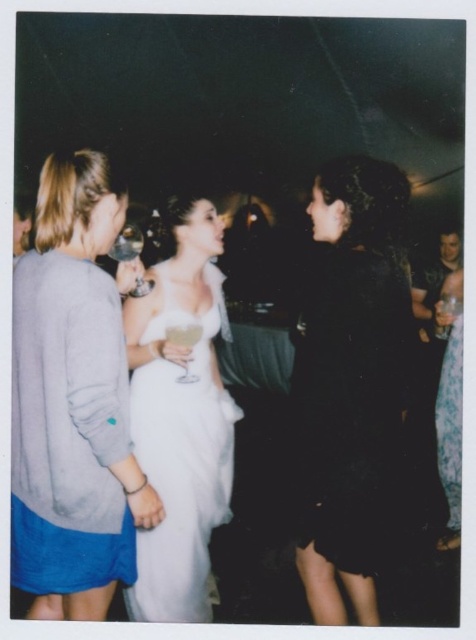
Which is behind, point (106, 163) or point (115, 257)?

Point (115, 257)

From the picture: Does light gray sweater at left have a lesser width compared to translucent glass wine glass at center?

Correct, light gray sweater at left's width is less than translucent glass wine glass at center's.

This screenshot has width=476, height=640. I want to click on light gray sweater at left, so click(73, 401).

In the scene shown: Can you confirm if light gray sweater at left is positioned above floral-patterned fabric dress at right?

Indeed, light gray sweater at left is positioned over floral-patterned fabric dress at right.

Which is behind, point (95, 480) or point (446, 401)?

Positioned behind is point (446, 401).

Does point (109, 554) come behind point (453, 429)?

No, (109, 554) is in front of (453, 429).

Identify the location of light gray sweater at left. (73, 401).

Does point (168, 380) come closer to viewer compared to point (117, 237)?

That is True.

The width and height of the screenshot is (476, 640). Describe the element at coordinates (181, 458) in the screenshot. I see `white satin dress at center` at that location.

Which is behind, point (196, 554) or point (130, 236)?

The point (130, 236) is more distant.

Image resolution: width=476 pixels, height=640 pixels. In order to click on white satin dress at center in this screenshot , I will do `click(181, 458)`.